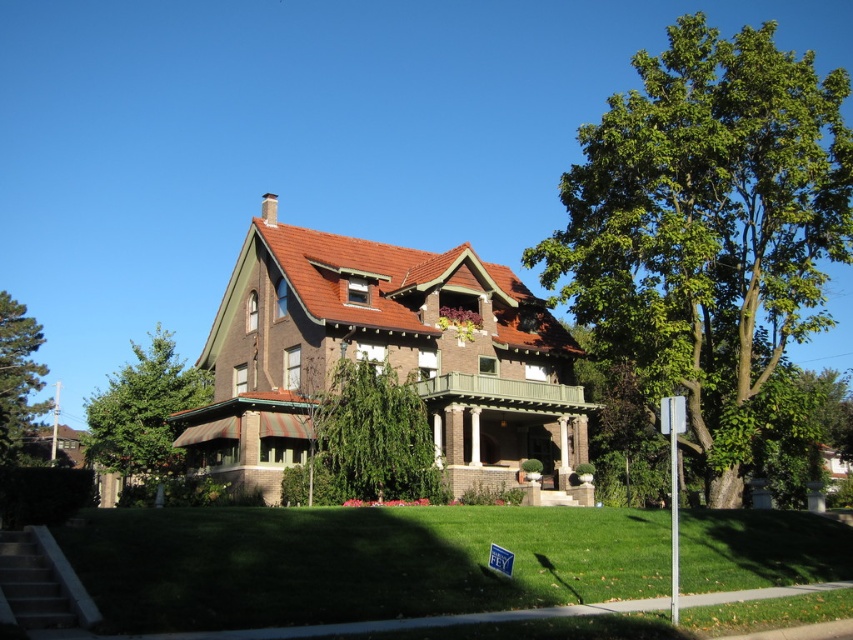
You are standing in front of the house and want to know which tree is larger between the green leafy tree at upper right and the green leafy tree at left. Can you determine this based on their positions and sizes?

The green leafy tree at upper right is bigger than the green leafy tree at left, so the one at upper right is larger.